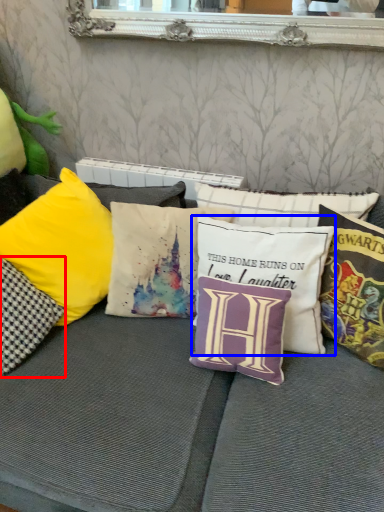
Question: Which object appears farthest to the camera in this image, pillow (highlighted by a red box) or pillow (highlighted by a blue box)?

Choices:
 (A) pillow
 (B) pillow

Answer: (B)